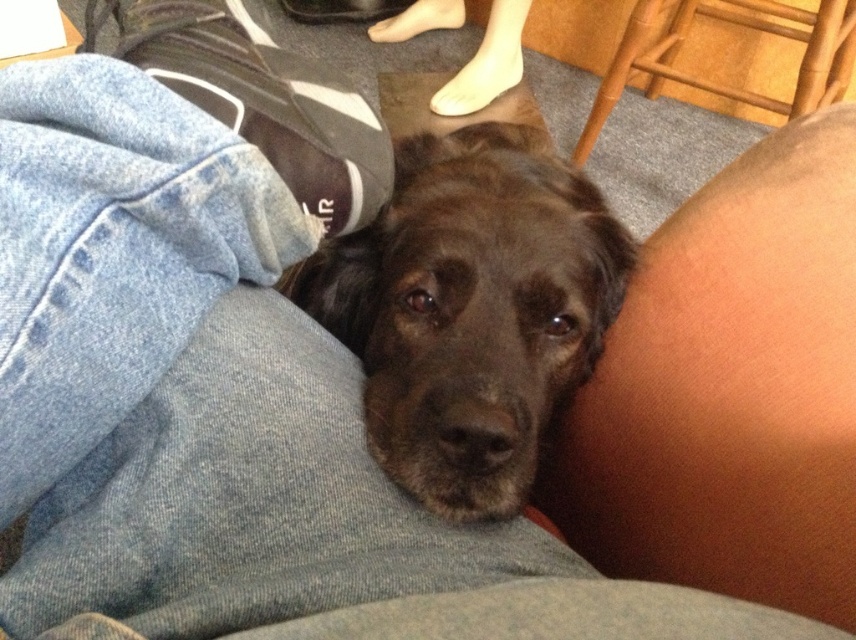
Question: Can you confirm if shiny brown fur at center is bigger than bamboo chair at upper right?

Choices:
 (A) no
 (B) yes

Answer: (A)

Question: Which of these objects is positioned closest to the skinny white foot at upper center?

Choices:
 (A) bamboo chair at upper right
 (B) shiny brown fur at center

Answer: (A)

Question: Considering the real-world distances, which object is farthest from the shiny brown fur at center?

Choices:
 (A) skinny white foot at upper center
 (B) bamboo chair at upper right

Answer: (A)

Question: In this image, where is shiny brown fur at center located relative to bamboo chair at upper right?

Choices:
 (A) below
 (B) above

Answer: (A)

Question: Does shiny brown fur at center have a larger size compared to skinny white foot at upper center?

Choices:
 (A) no
 (B) yes

Answer: (B)

Question: Which is farther from the skinny white foot at upper center?

Choices:
 (A) shiny brown fur at center
 (B) bamboo chair at upper right

Answer: (A)